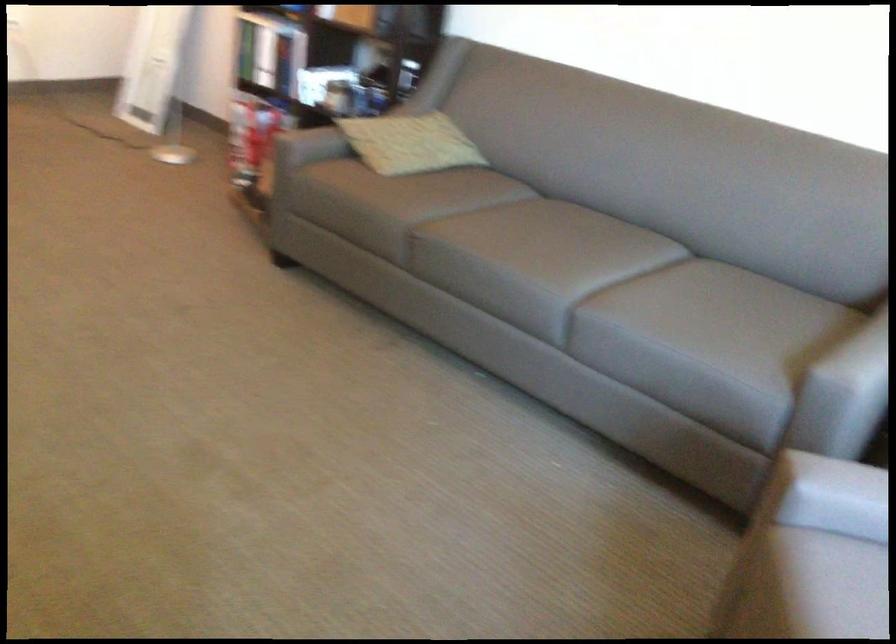
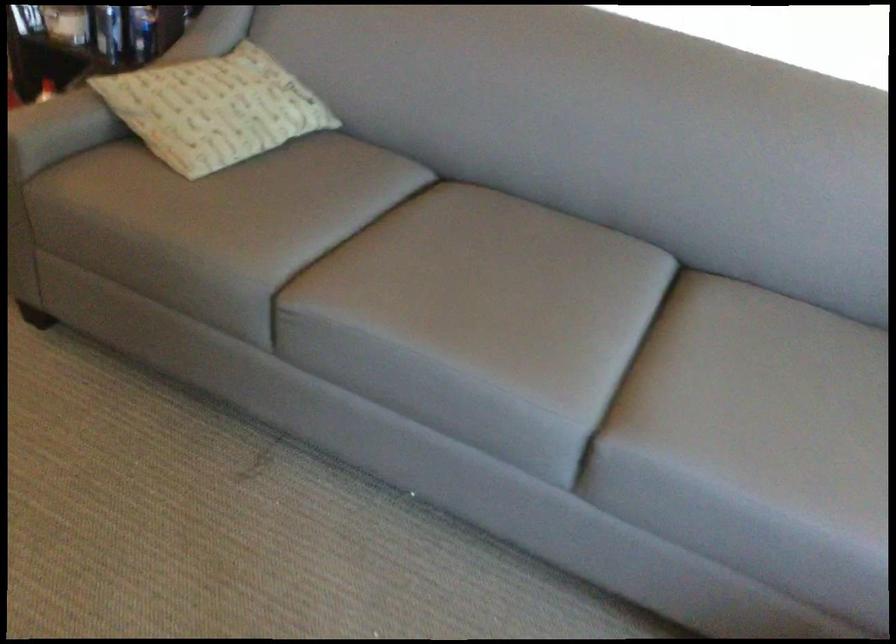
The point at (280, 131) is marked in the first image. Where is the corresponding point in the second image?

(32, 125)